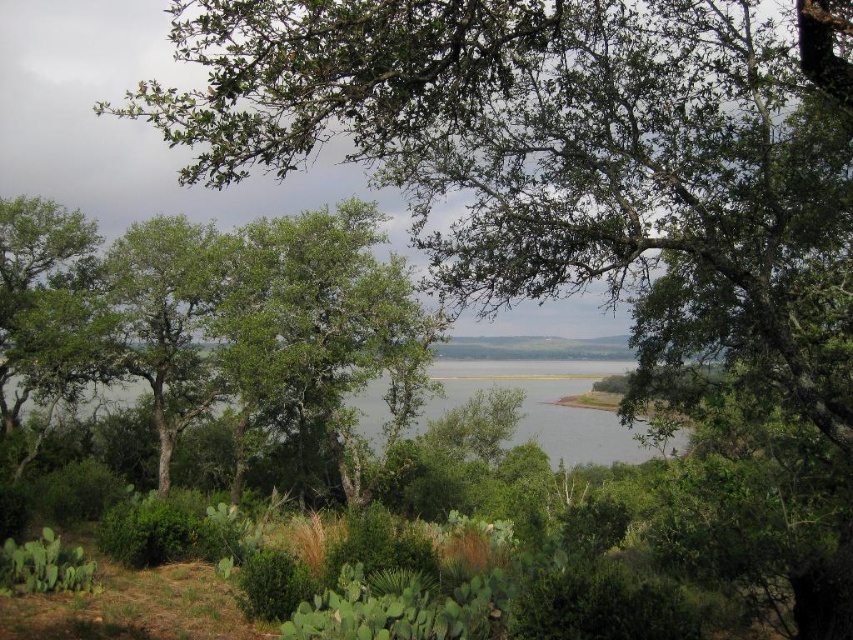
Question: Is the position of green leafy tree at center more distant than that of green leafy water at center?

Choices:
 (A) no
 (B) yes

Answer: (B)

Question: Is green leafy tree at center thinner than green leafy water at center?

Choices:
 (A) yes
 (B) no

Answer: (A)

Question: Which of the following is the closest to the observer?

Choices:
 (A) green leafy tree at center
 (B) green leafy water at center

Answer: (B)

Question: Among these points, which one is farthest from the camera?

Choices:
 (A) (369, 401)
 (B) (161, 406)

Answer: (A)

Question: Is green leafy tree at center smaller than green leafy water at center?

Choices:
 (A) no
 (B) yes

Answer: (A)